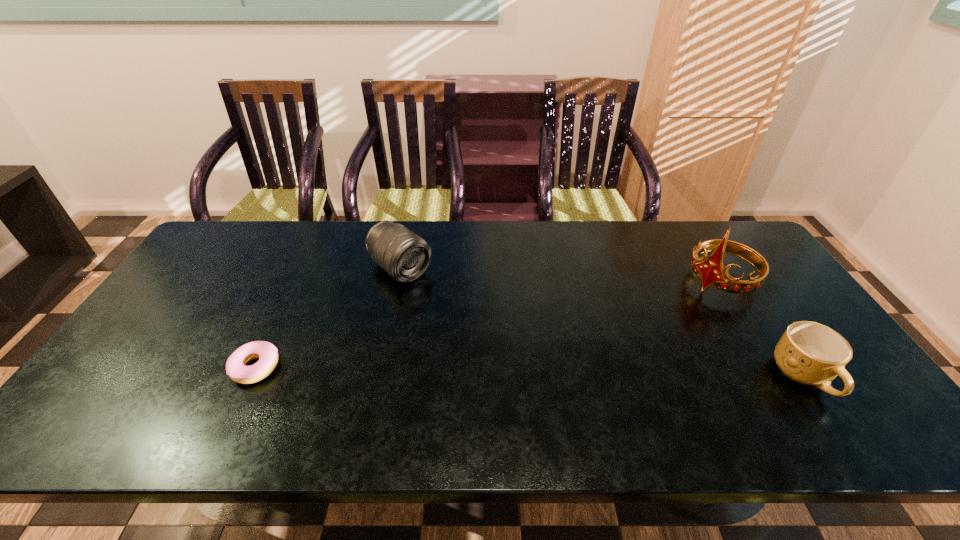
Locate an element on the screen. Image resolution: width=960 pixels, height=540 pixels. object situated at the near right corner is located at coordinates (810, 353).

Find the location of a particular element. vacant space at the far edge of the desktop is located at coordinates (484, 260).

The image size is (960, 540). Identify the location of vacant space at the near edge. (327, 381).

This screenshot has height=540, width=960. What are the coordinates of `vacant space at the left edge of the desktop` in the screenshot? It's located at (188, 279).

Locate an element on the screen. The width and height of the screenshot is (960, 540). vacant space at the right edge of the desktop is located at coordinates (795, 301).

At what (x,y) coordinates should I click in order to perform the action: click on vacant space at the far left corner of the desktop. Please return your answer as a coordinate pair (x, y). The height and width of the screenshot is (540, 960). Looking at the image, I should click on (241, 261).

Locate an element on the screen. This screenshot has width=960, height=540. blank region between the telephoto lens and the tallest object is located at coordinates (560, 275).

Find the location of a particular element. This screenshot has height=540, width=960. free space that is in between the second shortest object and the telephoto lens is located at coordinates (602, 322).

Image resolution: width=960 pixels, height=540 pixels. Find the location of `vacant space in between the second object from left to right and the shortest object`. vacant space in between the second object from left to right and the shortest object is located at coordinates (327, 318).

Find the location of `free area in between the third tallest object and the shortest object`. free area in between the third tallest object and the shortest object is located at coordinates (530, 372).